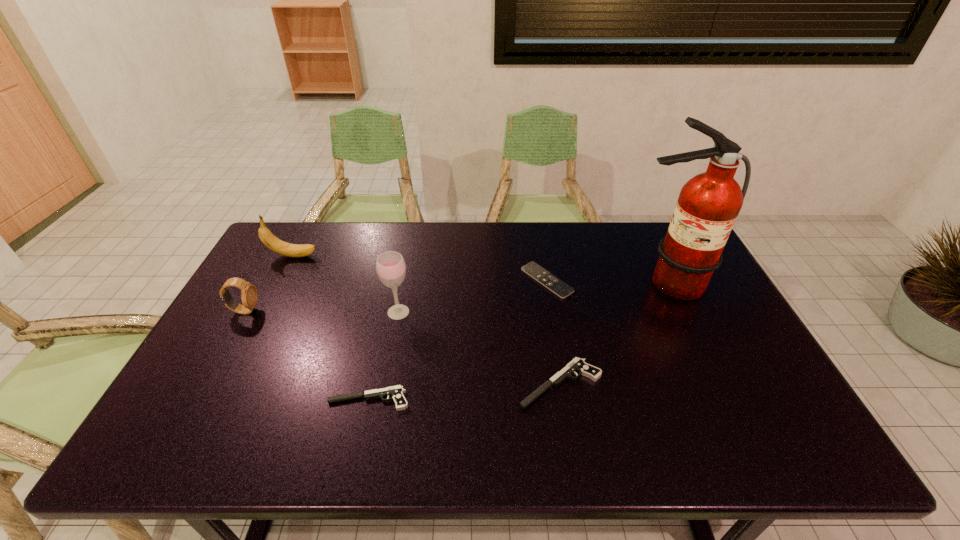
I want to click on the left pistol, so click(x=396, y=392).

Where is `the sixth tallest object`? The image size is (960, 540). the sixth tallest object is located at coordinates (396, 392).

Find the location of a particular element. the right pistol is located at coordinates (577, 364).

In order to click on the taller pistol in this screenshot , I will do `click(577, 364)`.

The height and width of the screenshot is (540, 960). I want to click on banana, so click(x=272, y=242).

The image size is (960, 540). I want to click on the farthest object, so click(272, 242).

This screenshot has width=960, height=540. Find the location of `the fourth shortest object`. the fourth shortest object is located at coordinates (249, 297).

The image size is (960, 540). I want to click on wineglass, so click(390, 266).

Where is `remote control`? This screenshot has width=960, height=540. remote control is located at coordinates (558, 287).

You are a GUI agent. You are given a task and a screenshot of the screen. Output one action in this format:
    pyautogui.click(x=<x>, y=<y>)
    Task: Click on the fire extinguisher
    
    Given the screenshot: What is the action you would take?
    pyautogui.click(x=708, y=205)